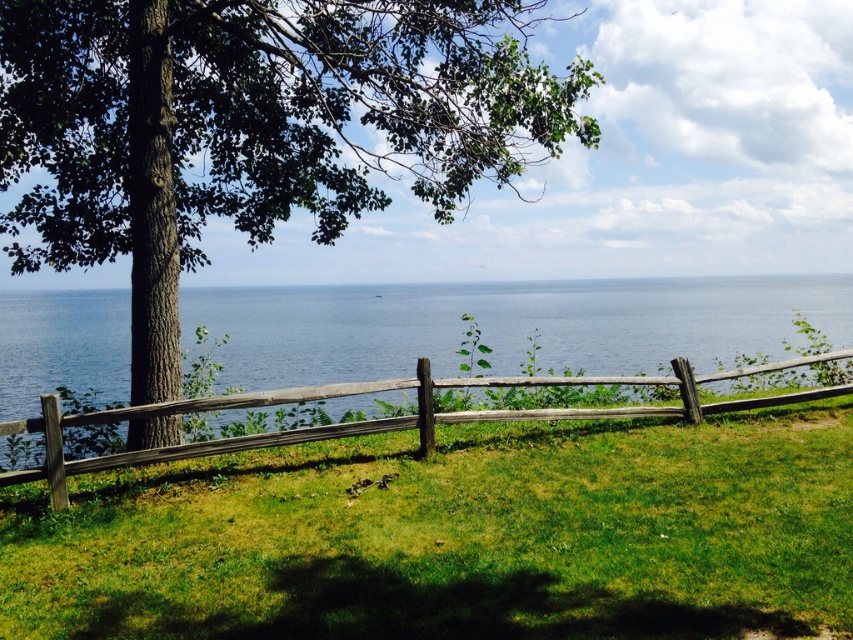
Is green grassy at center taller than green rough bark tree at center?

In fact, green grassy at center may be shorter than green rough bark tree at center.

Does green grassy at center have a lesser height compared to green rough bark tree at center?

Correct, green grassy at center is not as tall as green rough bark tree at center.

Who is more forward, (839, 500) or (431, 147)?

Point (839, 500)

Find the location of a particular element. The width and height of the screenshot is (853, 640). green grassy at center is located at coordinates (456, 536).

Which is more to the left, green grassy at center or wooden split rail fence at center?

green grassy at center is more to the left.

Is green grassy at center thinner than wooden split rail fence at center?

Yes, green grassy at center is thinner than wooden split rail fence at center.

This screenshot has height=640, width=853. Describe the element at coordinates (456, 536) in the screenshot. I see `green grassy at center` at that location.

The width and height of the screenshot is (853, 640). Identify the location of green grassy at center. (456, 536).

The width and height of the screenshot is (853, 640). Describe the element at coordinates (253, 125) in the screenshot. I see `green rough bark tree at center` at that location.

Can you confirm if green rough bark tree at center is taller than wooden split rail fence at center?

Yes.

What do you see at coordinates (253, 125) in the screenshot? I see `green rough bark tree at center` at bounding box center [253, 125].

Locate an element on the screen. green rough bark tree at center is located at coordinates (253, 125).